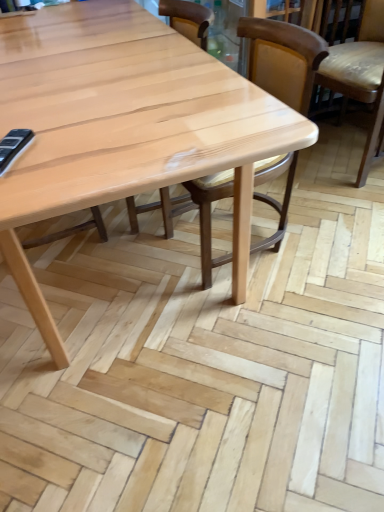
Question: Is the depth of wooden chair at center, placed as the second chair when sorted from right to left, greater than that of natural wood chair at center, which is the first chair in left-to-right order?

Choices:
 (A) yes
 (B) no

Answer: (B)

Question: Can you confirm if wooden chair at center, acting as the 2th chair starting from the left, is bigger than natural wood chair at center, which is the first chair in left-to-right order?

Choices:
 (A) no
 (B) yes

Answer: (A)

Question: From a real-world perspective, does wooden chair at center, acting as the 2th chair starting from the left, sit lower than natural wood chair at center, which is the first chair in left-to-right order?

Choices:
 (A) no
 (B) yes

Answer: (B)

Question: Is natural wood chair at center, which is the 3th chair in right-to-left order, inside wooden chair at center, acting as the 2th chair starting from the left?

Choices:
 (A) no
 (B) yes

Answer: (A)

Question: In the image, is light brown leather chair at right, which is the 3th chair in left-to-right order, on the left side or the right side of wooden chair at center, acting as the 2th chair starting from the left?

Choices:
 (A) left
 (B) right

Answer: (B)

Question: Considering their positions, is light brown leather chair at right, which is the 3th chair in left-to-right order, located in front of or behind wooden chair at center, placed as the second chair when sorted from right to left?

Choices:
 (A) front
 (B) behind

Answer: (B)

Question: From the image's perspective, is light brown leather chair at right, arranged as the first chair when viewed from the right, positioned above or below wooden chair at center, acting as the 2th chair starting from the left?

Choices:
 (A) above
 (B) below

Answer: (A)

Question: Based on their sizes in the image, would you say light brown leather chair at right, arranged as the first chair when viewed from the right, is bigger or smaller than wooden chair at center, acting as the 2th chair starting from the left?

Choices:
 (A) big
 (B) small

Answer: (A)

Question: Based on their positions, is natural wood chair at center, which is the first chair in left-to-right order, located to the left or right of light brown leather chair at right, which is the 3th chair in left-to-right order?

Choices:
 (A) right
 (B) left

Answer: (B)

Question: Is point (183, 22) positioned closer to the camera than point (380, 68)?

Choices:
 (A) farther
 (B) closer

Answer: (B)

Question: Considering the positions of natural wood chair at center, which is the 3th chair in right-to-left order, and light brown leather chair at right, arranged as the first chair when viewed from the right, in the image, is natural wood chair at center, which is the 3th chair in right-to-left order, wider or thinner than light brown leather chair at right, arranged as the first chair when viewed from the right,?

Choices:
 (A) thin
 (B) wide

Answer: (A)

Question: Relative to light brown leather chair at right, arranged as the first chair when viewed from the right, is natural wood chair at center, which is the 3th chair in right-to-left order, in front or behind?

Choices:
 (A) front
 (B) behind

Answer: (A)

Question: Visually, is natural wood chair at center, which is the 3th chair in right-to-left order, positioned to the left or to the right of wooden chair at center, acting as the 2th chair starting from the left?

Choices:
 (A) left
 (B) right

Answer: (A)

Question: Considering the positions of natural wood chair at center, which is the first chair in left-to-right order, and wooden chair at center, placed as the second chair when sorted from right to left, in the image, is natural wood chair at center, which is the first chair in left-to-right order, bigger or smaller than wooden chair at center, placed as the second chair when sorted from right to left,?

Choices:
 (A) small
 (B) big

Answer: (B)